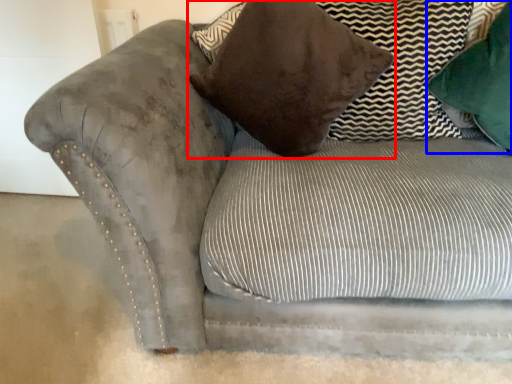
Question: Which object appears farthest to the camera in this image, pillow (highlighted by a red box) or pillow (highlighted by a blue box)?

Choices:
 (A) pillow
 (B) pillow

Answer: (B)